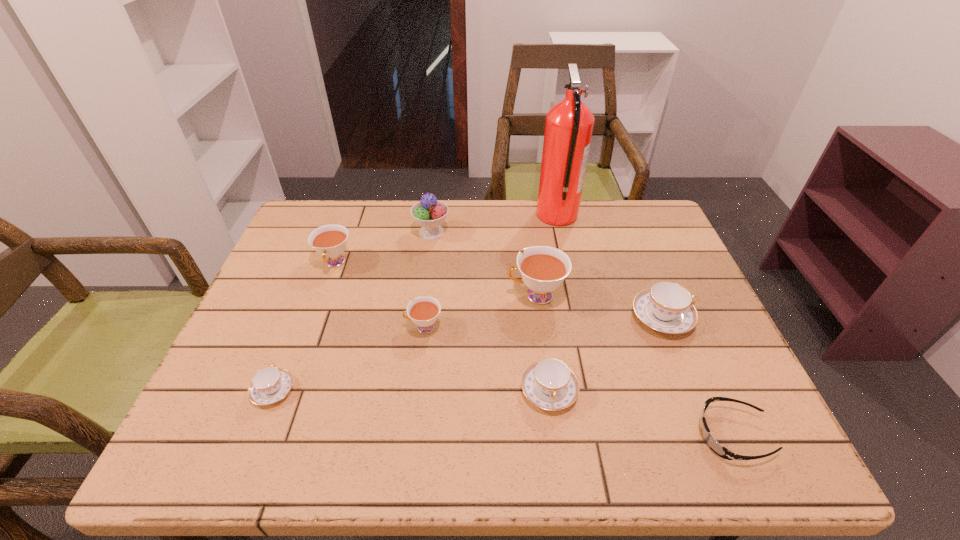
Identify the location of blank area located 0.240m on the lenses of the shortest object. This screenshot has width=960, height=540. (574, 435).

Where is `free space located 0.400m on the lenses of the shortest object`? The image size is (960, 540). free space located 0.400m on the lenses of the shortest object is located at coordinates (492, 435).

Locate an element on the screen. fire extinguisher at the far edge is located at coordinates (569, 124).

Where is `icecream present at the far edge`? The width and height of the screenshot is (960, 540). icecream present at the far edge is located at coordinates (429, 213).

Find the location of `object that is at the near edge`. object that is at the near edge is located at coordinates (720, 450).

Find the location of a particular element. The image size is (960, 540). teacup positioned at the right edge is located at coordinates (666, 307).

This screenshot has height=540, width=960. I want to click on sunglasses positioned at the right edge, so click(x=720, y=450).

Where is `object positioned at the near right corner`? object positioned at the near right corner is located at coordinates (720, 450).

Identify the location of vacant space at the far edge of the desktop. (503, 202).

Where is `free point at the near edge`? The width and height of the screenshot is (960, 540). free point at the near edge is located at coordinates (315, 460).